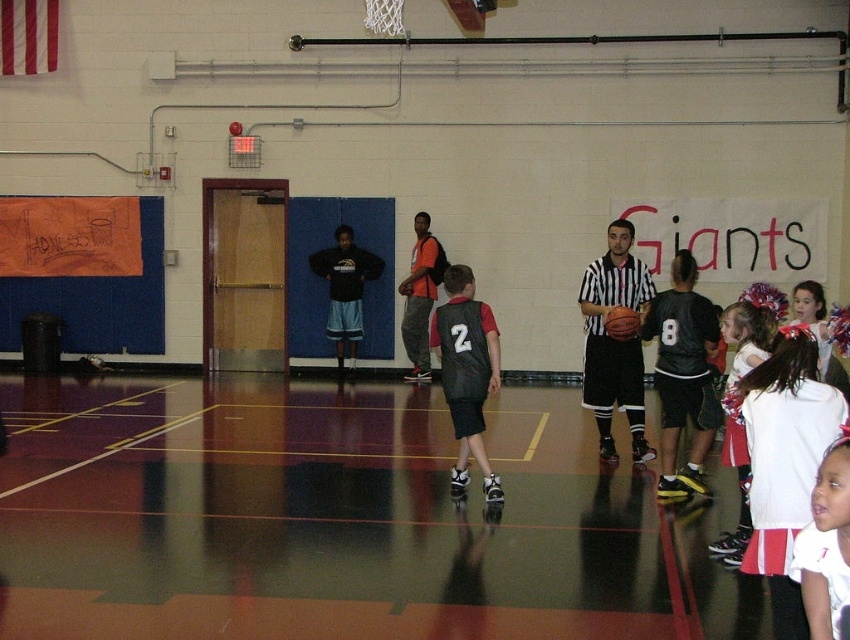
Question: Can you confirm if striped jersey referee at center is positioned above rubber textured basketball at center?

Choices:
 (A) yes
 (B) no

Answer: (B)

Question: Which object appears farthest from the camera in this image?

Choices:
 (A) striped jersey referee at center
 (B) white fluffy pom-pom at upper right
 (C) matte black jersey at center

Answer: (A)

Question: Does white fluffy pom-pom at upper right come behind rubber textured basketball at center?

Choices:
 (A) no
 (B) yes

Answer: (A)

Question: Among these points, which one is nearest to the camera?

Choices:
 (A) click(x=802, y=362)
 (B) click(x=633, y=323)
 (C) click(x=768, y=346)
 (D) click(x=588, y=326)

Answer: (A)

Question: Is white fluffy pom-pom at upper right to the right of rubber textured basketball at center from the viewer's perspective?

Choices:
 (A) yes
 (B) no

Answer: (A)

Question: Which of these objects is positioned closest to the white cotton shirt at lower right?

Choices:
 (A) rubber textured basketball at center
 (B) white fluffy pom-pom at upper right

Answer: (B)